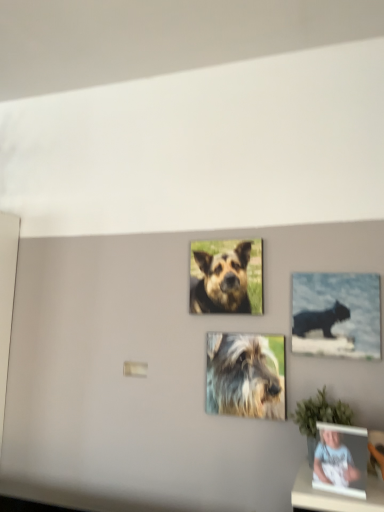
Question: From the image's perspective, is fuzzy fur dog at center, the second dog positioned from the top, positioned above or below matte black photo frame at lower right?

Choices:
 (A) above
 (B) below

Answer: (A)

Question: Looking at the image, does fuzzy fur dog at center, the 1th dog when ordered from bottom to top, seem bigger or smaller compared to matte black photo frame at lower right?

Choices:
 (A) small
 (B) big

Answer: (B)

Question: Considering the real-world distances, which object is closest to the fuzzy fur dog at center, the 1th dog when ordered from bottom to top?

Choices:
 (A) brown fur dog at center, which is counted as the 1th dog, starting from the top
 (B) black glossy cat at upper right
 (C) matte black photo frame at lower right

Answer: (B)

Question: Estimate the real-world distances between objects in this image. Which object is closer to the black glossy cat at upper right?

Choices:
 (A) matte black photo frame at lower right
 (B) fuzzy fur dog at center, the 1th dog when ordered from bottom to top
 (C) brown fur dog at center, which is counted as the 1th dog, starting from the top

Answer: (B)